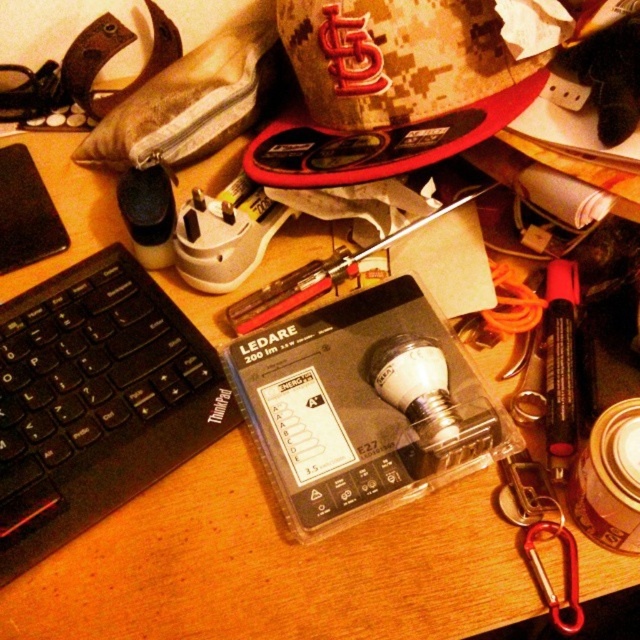
Is point (81, 285) positioned before point (339, 273)?

Yes, point (81, 285) is in front of point (339, 273).

Does point (144, 422) lie behind point (330, 269)?

That is False.

Find the location of a particular element. This screenshot has height=640, width=640. black plastic keyboard at left is located at coordinates (96, 401).